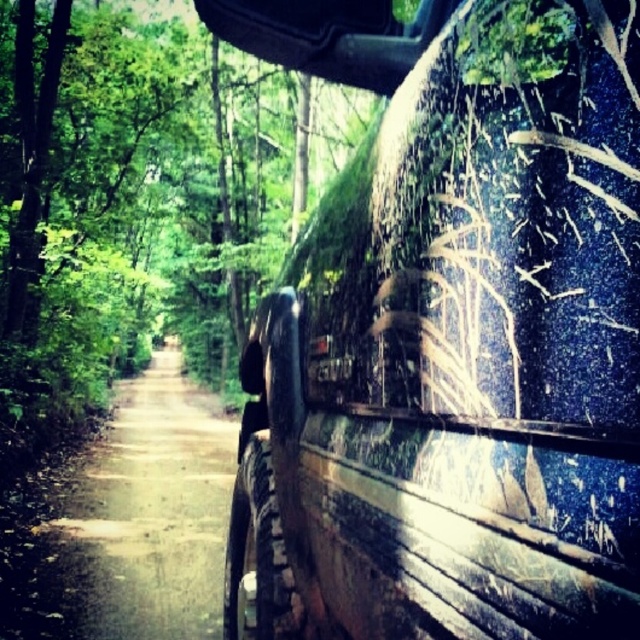
Question: Observing the image, what is the correct spatial positioning of muddy rubber tire at right in reference to dirt road at center?

Choices:
 (A) left
 (B) right

Answer: (B)

Question: Which point appears closest to the camera in this image?

Choices:
 (A) (48, 608)
 (B) (388, 545)

Answer: (B)

Question: Among these points, which one is farthest from the camera?

Choices:
 (A) (624, 81)
 (B) (205, 612)

Answer: (B)

Question: Does muddy rubber tire at right appear on the right side of dirt road at center?

Choices:
 (A) yes
 (B) no

Answer: (A)

Question: Which point is farther to the camera?

Choices:
 (A) (22, 593)
 (B) (538, 525)

Answer: (A)

Question: Can you confirm if muddy rubber tire at right is smaller than dirt road at center?

Choices:
 (A) no
 (B) yes

Answer: (B)